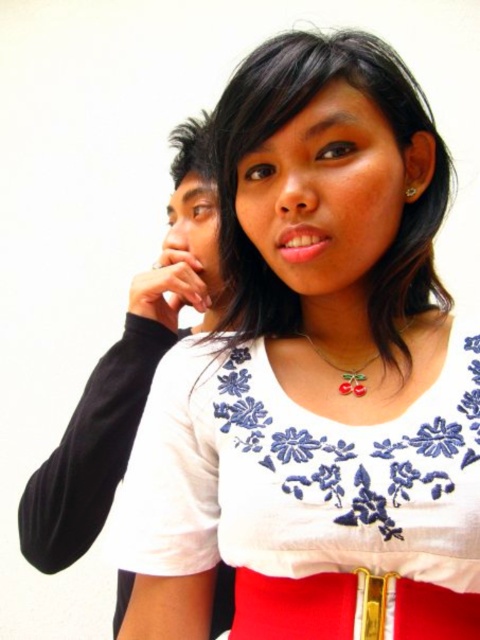
Does white embroidered dress at center appear over red leather belt at center?

Indeed, white embroidered dress at center is positioned over red leather belt at center.

Which is below, white embroidered dress at center or red leather belt at center?

red leather belt at center is below.

Between point (128, 499) and point (261, 595), which one is positioned behind?

Point (128, 499)

The image size is (480, 640). Find the location of `white embroidered dress at center`. white embroidered dress at center is located at coordinates (309, 499).

From the picture: Can you confirm if white embroidered dress at center is taller than black matte shirt at left?

In fact, white embroidered dress at center may be shorter than black matte shirt at left.

Which is behind, point (447, 570) or point (179, 237)?

The point (179, 237) is behind.

Describe the element at coordinates (309, 499) in the screenshot. The image size is (480, 640). I see `white embroidered dress at center` at that location.

Where is `white embroidered dress at center`? This screenshot has width=480, height=640. white embroidered dress at center is located at coordinates (309, 499).

Does black matte shirt at left have a smaller size compared to red leather belt at center?

No.

Who is shorter, black matte shirt at left or red leather belt at center?

Standing shorter between the two is red leather belt at center.

Describe the element at coordinates (128, 369) in the screenshot. I see `black matte shirt at left` at that location.

Locate an element on the screen. black matte shirt at left is located at coordinates [128, 369].